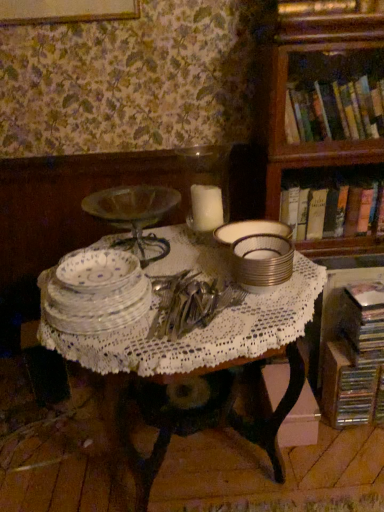
Question: From the image's perspective, is white wax candle at center above or below wooden bookcase at upper right?

Choices:
 (A) below
 (B) above

Answer: (A)

Question: Looking at the image, does white wax candle at center seem bigger or smaller compared to wooden bookcase at upper right?

Choices:
 (A) small
 (B) big

Answer: (A)

Question: Which object is the farthest from the white lace tablecloth at center?

Choices:
 (A) silver metallic stack at center, the second tableware viewed from the left
 (B) porcelain plate at center
 (C) wooden bookcase at upper right
 (D) white wax candle at center
 (E) hardcover book at right, the 2th book positioned from the bottom

Answer: (C)

Question: Estimate the real-world distances between objects in this image. Which object is farther from the clear glass plates at center, positioned as the first tableware in left-to-right order?

Choices:
 (A) wooden bookcase at upper right
 (B) white wax candle at center
 (C) hardcover books at upper right, the 3th book from the bottom
 (D) silver metallic stack at center, positioned as the 1th tableware in right-to-left order
 (E) hardcover book at right, the 2th book from the top

Answer: (C)